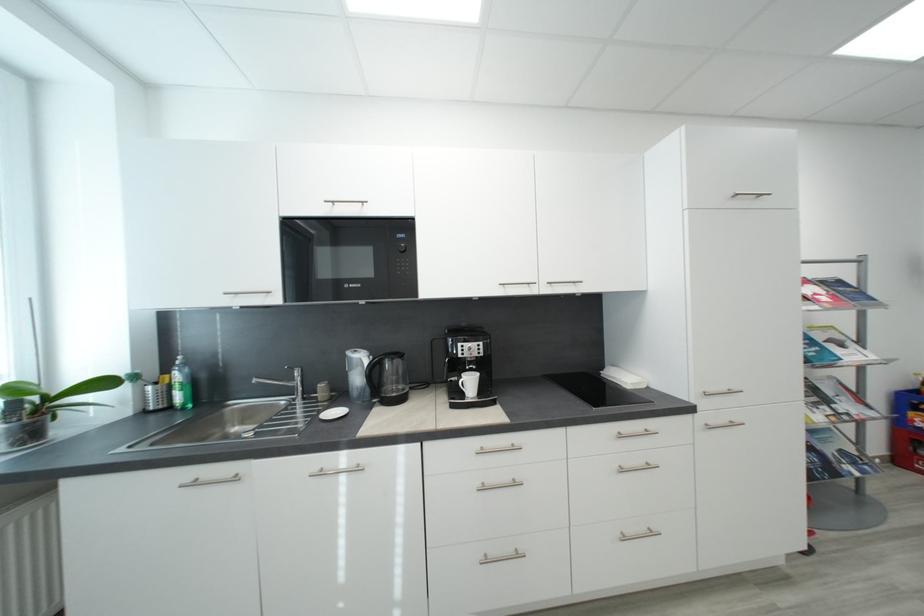
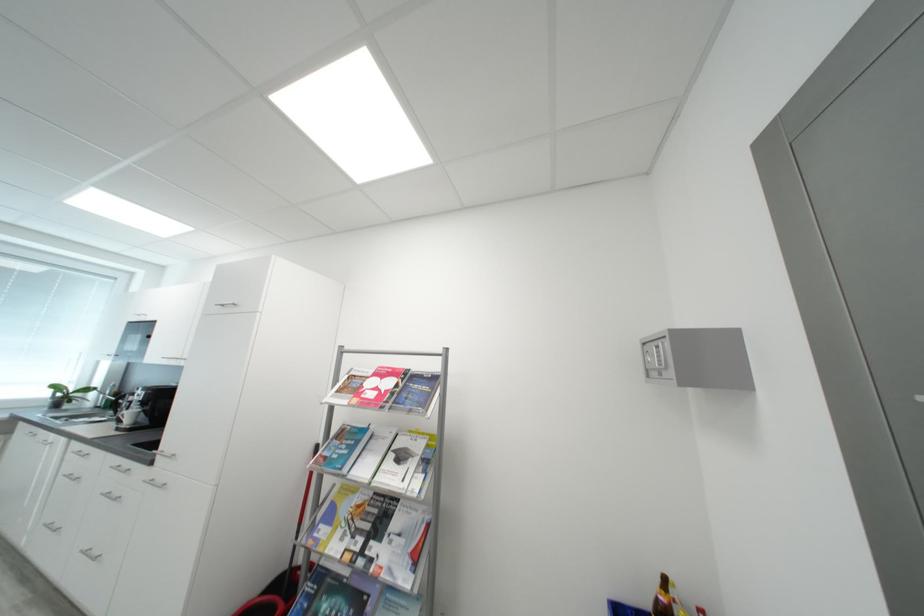
Find the pixel in the second image that matches (x=477, y=384) in the first image.

(138, 416)